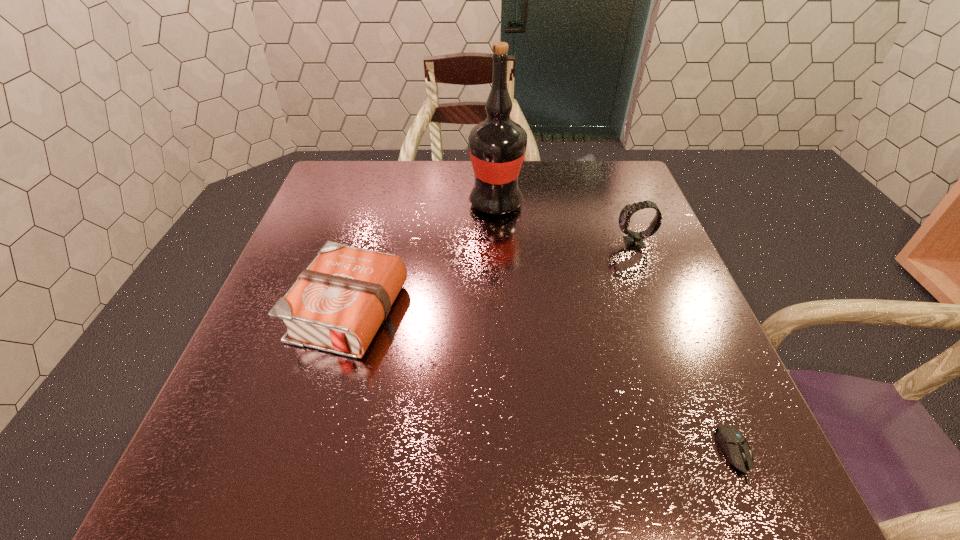
This screenshot has width=960, height=540. Find the location of `blank area located 0.050m on the face of the third shortest object`. blank area located 0.050m on the face of the third shortest object is located at coordinates (594, 243).

Find the location of `free space located on the face of the third shortest object`. free space located on the face of the third shortest object is located at coordinates (534, 243).

Where is `vacant region located 0.250m on the front of the second shortest object`? Image resolution: width=960 pixels, height=540 pixels. vacant region located 0.250m on the front of the second shortest object is located at coordinates (295, 503).

You are a GUI agent. You are given a task and a screenshot of the screen. Output one action in this format:
    pyautogui.click(x=<x>, y=<y>)
    Task: Click on the vacant space located 0.150m on the left of the shortest object
    The width and height of the screenshot is (960, 540).
    Given the screenshot: What is the action you would take?
    pyautogui.click(x=629, y=454)

In order to click on object at the far edge in this screenshot , I will do `click(497, 146)`.

The width and height of the screenshot is (960, 540). Find the location of `object that is positioned at the near edge`. object that is positioned at the near edge is located at coordinates (734, 444).

You are a GUI agent. You are given a task and a screenshot of the screen. Output one action in this format:
    pyautogui.click(x=<x>, y=<y>)
    Task: Click on the object that is at the left edge
    This screenshot has height=540, width=960.
    Given the screenshot: What is the action you would take?
    pyautogui.click(x=337, y=304)

I want to click on watch located at the right edge, so click(x=634, y=239).

Locate an element on the screen. This screenshot has height=540, width=960. computer mouse at the right edge is located at coordinates (734, 444).

Find the location of a particular element. This screenshot has width=960, height=540. object located in the near right corner section of the desktop is located at coordinates 734,444.